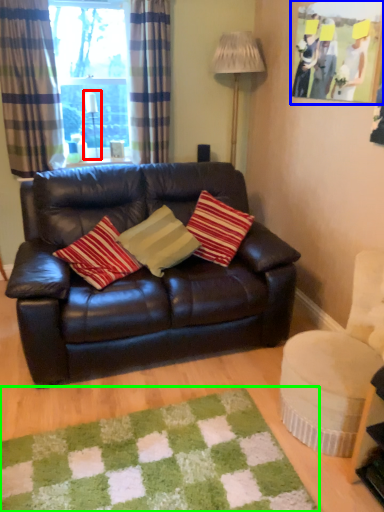
Question: Based on their relative distances, which object is nearer to lamp (highlighted by a red box)? Choose from picture frame (highlighted by a blue box) and mat (highlighted by a green box).

Choices:
 (A) picture frame
 (B) mat

Answer: (A)